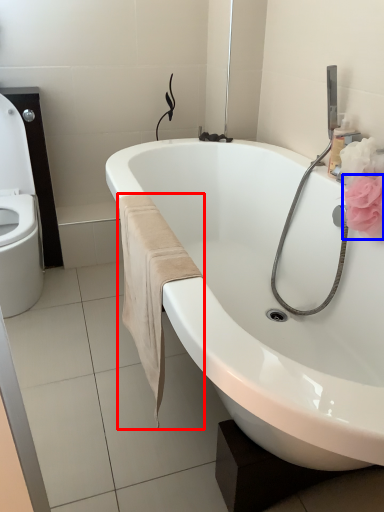
Question: Which object appears closest to the camera in this image, bath towel (highlighted by a red box) or flower (highlighted by a blue box)?

Choices:
 (A) bath towel
 (B) flower

Answer: (A)